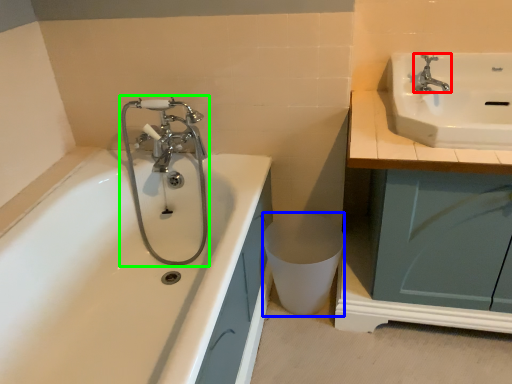
Question: Which object is the closest to the tap (highlighted by a red box)? Choose among these: toilet bowl (highlighted by a blue box) or plumbing fixture (highlighted by a green box).

Choices:
 (A) toilet bowl
 (B) plumbing fixture

Answer: (A)